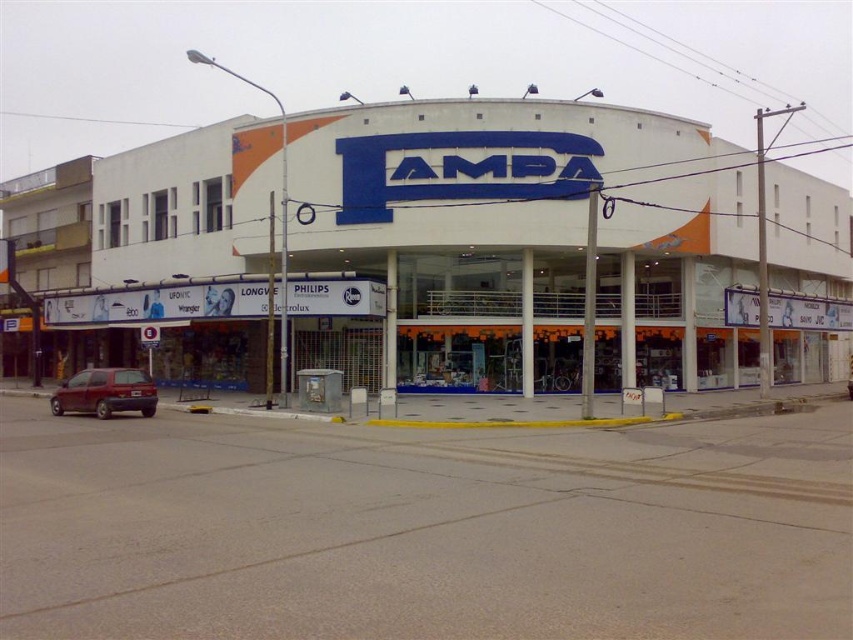
Is white matte building at center positioned at the back of maroon matte hatchback at lower left?

Yes, it is behind maroon matte hatchback at lower left.

Between white matte building at center and maroon matte hatchback at lower left, which one appears on the left side from the viewer's perspective?

maroon matte hatchback at lower left is more to the left.

Describe the element at coordinates (520, 241) in the screenshot. This screenshot has height=640, width=853. I see `white matte building at center` at that location.

Find the location of a particular element. white matte building at center is located at coordinates (520, 241).